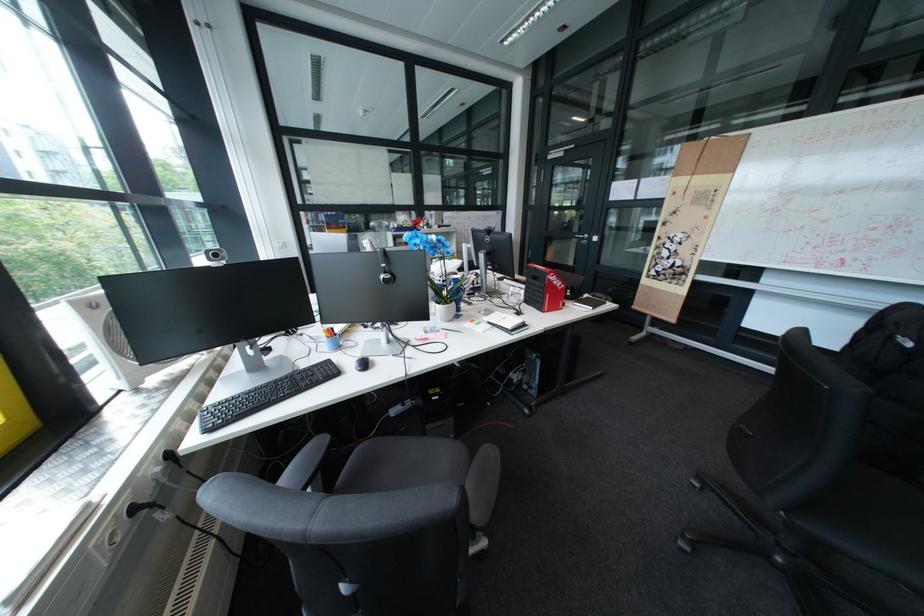
Where is `silver door handle`? This screenshot has width=924, height=616. silver door handle is located at coordinates (589, 238).